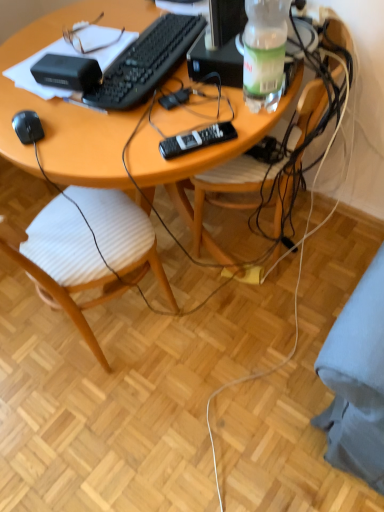
At what (x,y) coordinates should I click in order to perform the action: click on free space to the right of wooden chair at center, marked as the 2th chair in a left-to-right arrangement. Please return your answer as a coordinate pair (x, y). Image resolution: width=384 pixels, height=512 pixels. Looking at the image, I should click on (337, 241).